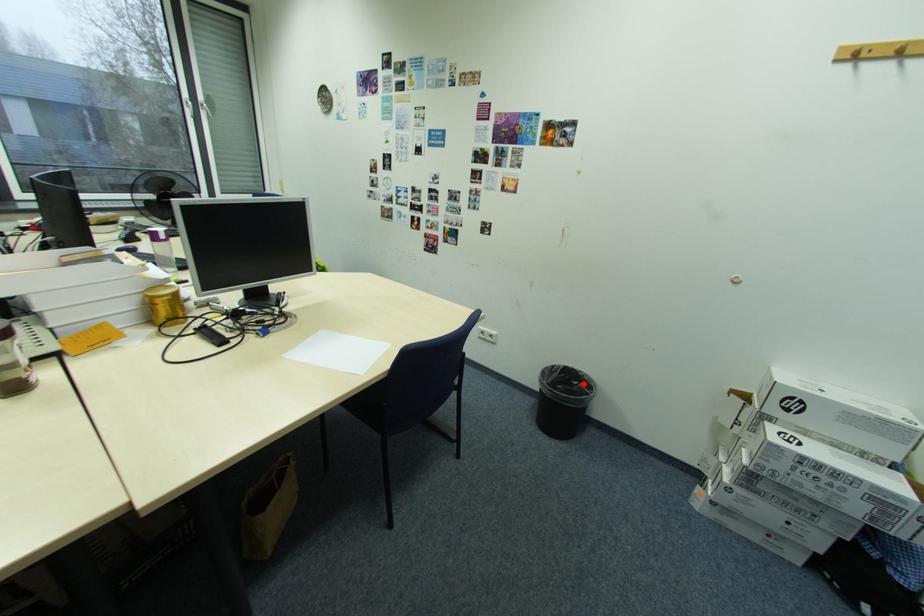
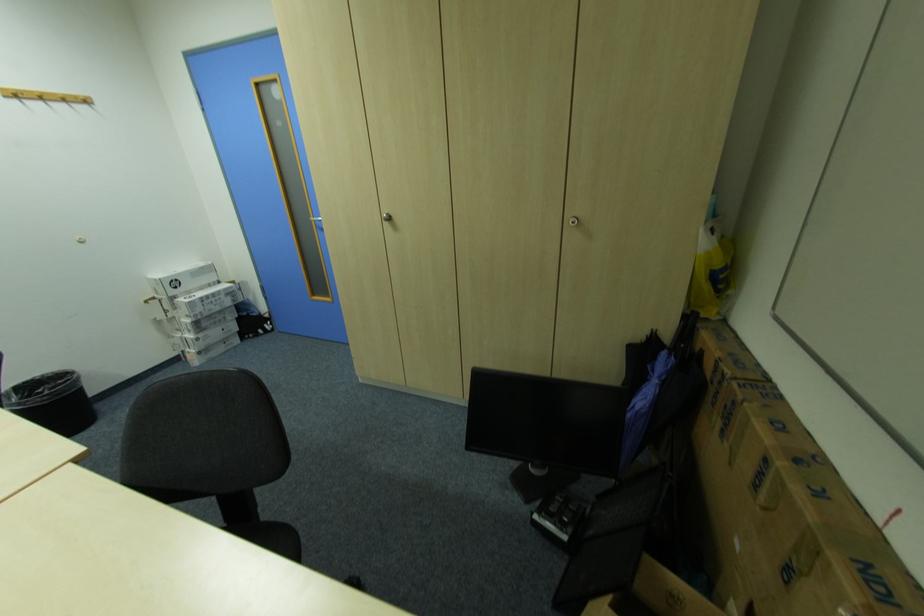
Question: I am providing you with two images of the same scene from different viewpoints. Image1 has a red point marked. In image2, the corresponding 3D location appears at what relative position? Reply with the corresponding letter.

Choices:
 (A) Closer
 (B) Farther

Answer: (B)